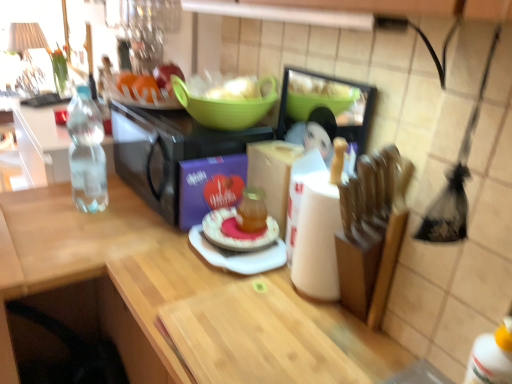
You are a GUI agent. You are given a task and a screenshot of the screen. Output one action in this format:
    pyautogui.click(x=<x>, y=<y>)
    Task: Click on the free spot to the left of clear plastic bottle at left
    The width and height of the screenshot is (512, 384).
    Given the screenshot: What is the action you would take?
    pyautogui.click(x=48, y=200)